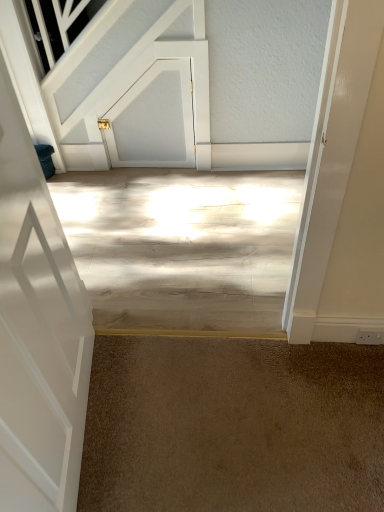
Where is `free space in front of white matte door at upper center, the 1th door viewed from the top`? The image size is (384, 512). free space in front of white matte door at upper center, the 1th door viewed from the top is located at coordinates (158, 195).